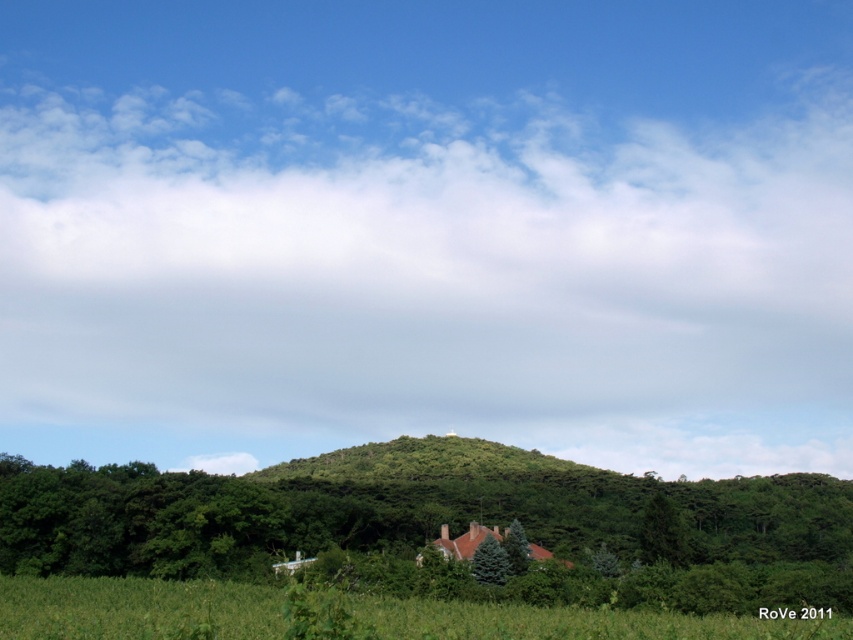
Does white fluffy cloud at upper center have a greater width compared to green leafy tree at center?

Correct, the width of white fluffy cloud at upper center exceeds that of green leafy tree at center.

What do you see at coordinates (422, 280) in the screenshot? I see `white fluffy cloud at upper center` at bounding box center [422, 280].

I want to click on white fluffy cloud at upper center, so click(x=422, y=280).

Does green matte tree at lower center appear on the left side of green matte tree at center?

Indeed, green matte tree at lower center is positioned on the left side of green matte tree at center.

Which of these two, green matte tree at lower center or green matte tree at center, stands shorter?

With less height is green matte tree at lower center.

Who is more forward, [485,541] or [509,564]?

Point [509,564] is in front.

Locate an element on the screen. green matte tree at lower center is located at coordinates (490, 561).

Which is in front, point (656, 560) or point (505, 563)?

Point (505, 563)

Can you confirm if green leafy tree at center is shorter than green matte tree at lower center?

Incorrect, green leafy tree at center's height does not fall short of green matte tree at lower center's.

Is point (109, 476) less distant than point (489, 579)?

No.

Identify the location of green leafy tree at center. (440, 524).